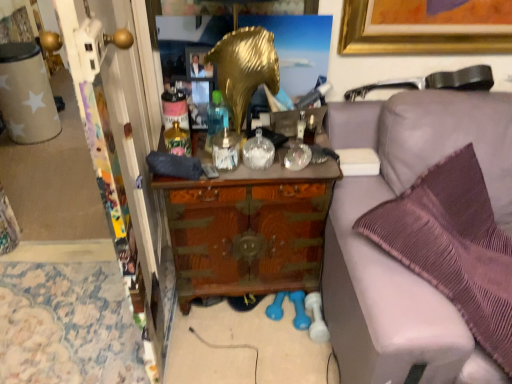
I want to click on vacant space to the right of matte gray remote control at center, so click(x=245, y=167).